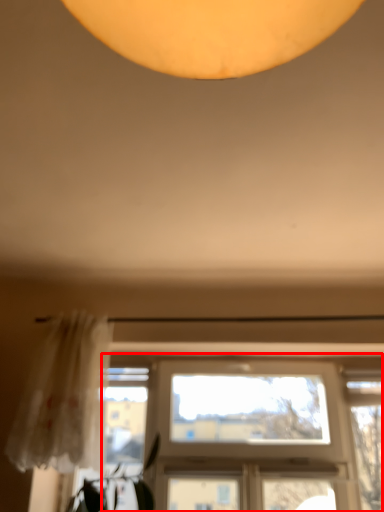
Question: Observing the image, what is the correct spatial positioning of window (annotated by the red box) in reference to curtain?

Choices:
 (A) right
 (B) left

Answer: (A)